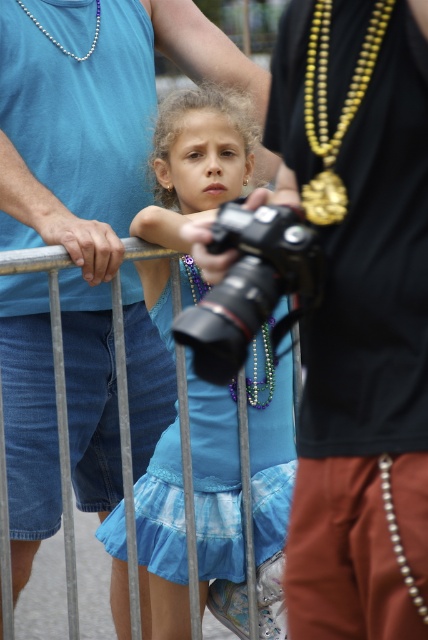
Question: Which of the following is the farthest from the observer?

Choices:
 (A) black plastic camera at center
 (B) pearl necklace at upper left

Answer: (B)

Question: Is gold metallic necklace at upper right bigger than pearl necklace at upper left?

Choices:
 (A) yes
 (B) no

Answer: (B)

Question: Which point is closer to the camera?

Choices:
 (A) (368, 45)
 (B) (305, 266)

Answer: (B)

Question: Is blue satin dress at center thinner than black plastic camera at center?

Choices:
 (A) yes
 (B) no

Answer: (B)

Question: Which of the following is the farthest from the observer?

Choices:
 (A) black plastic camera at center
 (B) gold metallic necklace at upper right
 (C) pearl necklace at upper left
 (D) blue satin dress at center

Answer: (C)

Question: Does blue satin dress at center have a smaller size compared to black plastic camera at center?

Choices:
 (A) yes
 (B) no

Answer: (B)